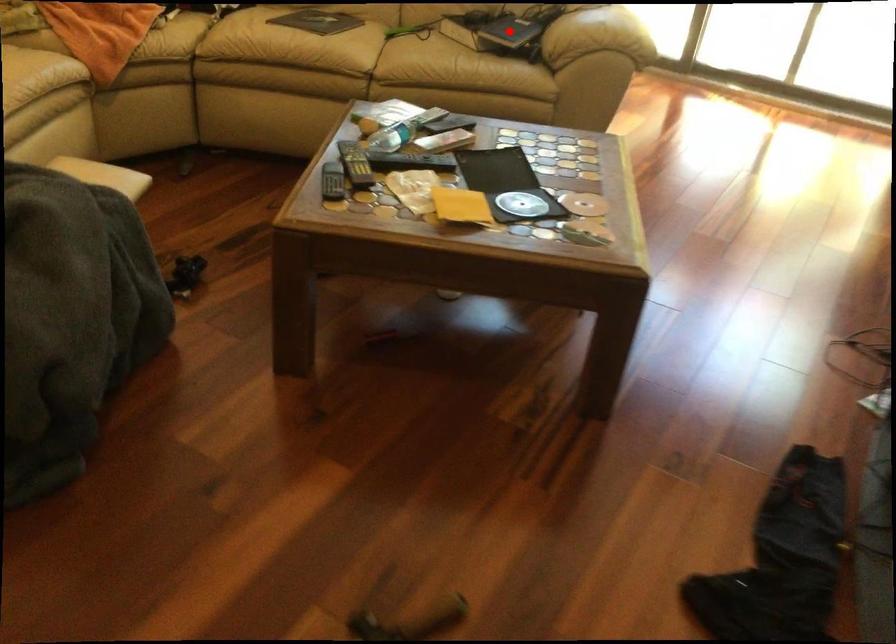
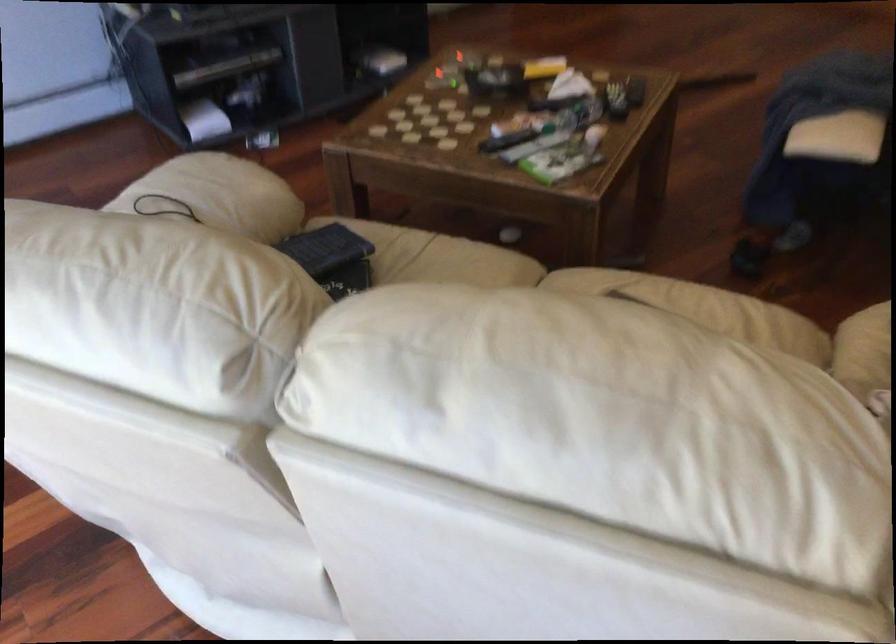
Question: I am providing you with two images of the same scene from different viewpoints. A red point is marked on the first image. Can you still see the location of the red point in image 2?

Choices:
 (A) Yes
 (B) No

Answer: (B)